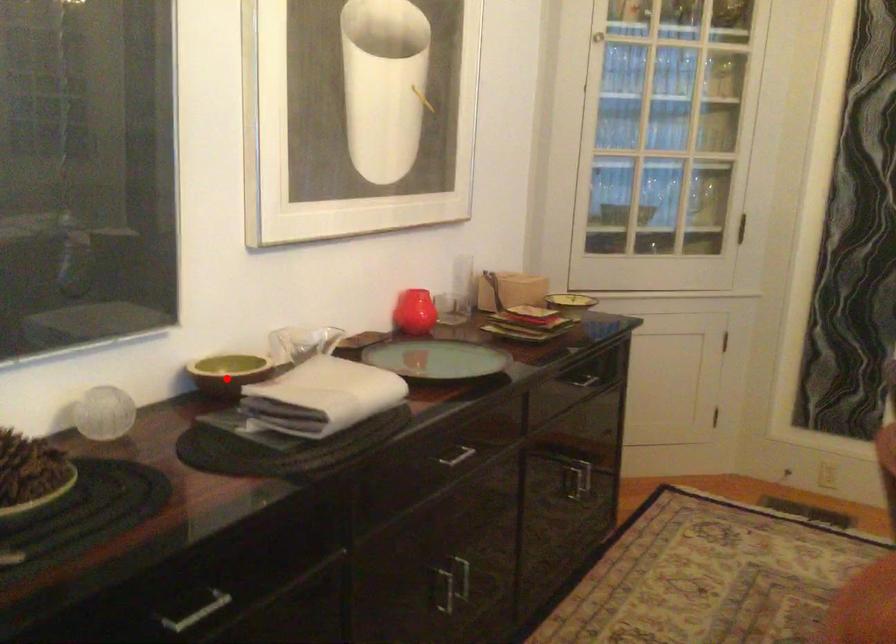
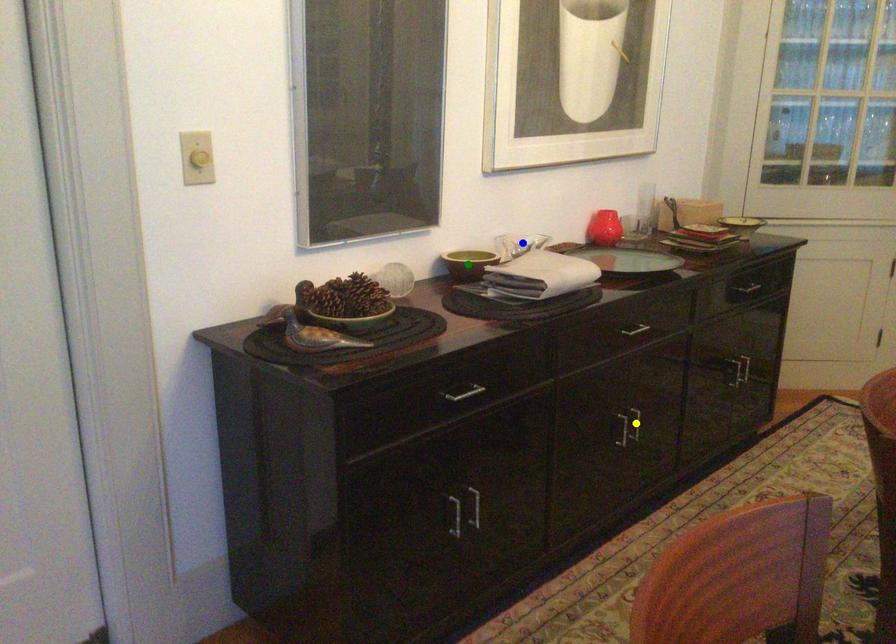
Question: I am providing you with two images of the same scene from different viewpoints. A red point is marked on the first image. You are given multiple points on the second image. Which point in image 2 is actually the same real-world point as the red point in image 1?

Choices:
 (A) green point
 (B) blue point
 (C) yellow point

Answer: (A)